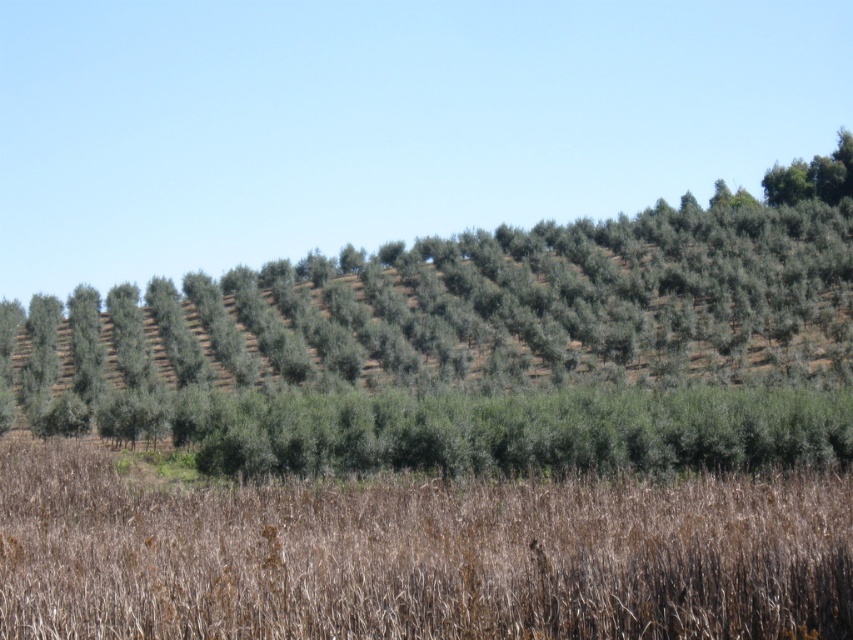
Which of these two, green leafy trees at center or brown dry grass at lower center, stands shorter?

Standing shorter between the two is brown dry grass at lower center.

Consider the image. Is green leafy trees at center further to camera compared to brown dry grass at lower center?

That is True.

Between point (680, 280) and point (30, 524), which one is positioned behind?

The point (680, 280) is more distant.

Image resolution: width=853 pixels, height=640 pixels. In order to click on green leafy trees at center in this screenshot , I will do `click(474, 349)`.